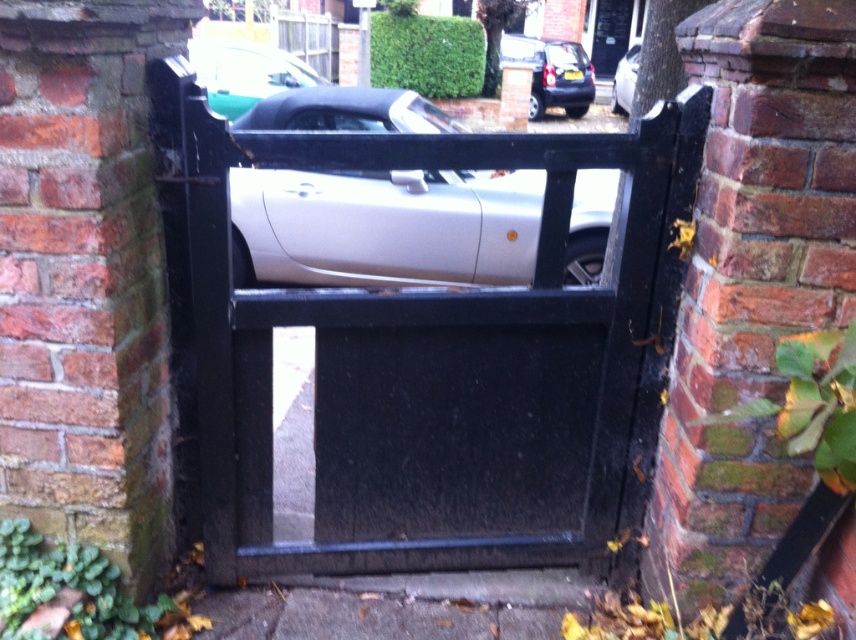
You are a delivery person trying to enter through the black wood gate at center. There is a satin silver car at center blocking the entrance. Can you pass through the gate without moving the car?

The black wood gate at center is bigger than the satin silver car at center, so there might be enough space around the car to pass through the gate without moving it. However, the exact path depends on the gate and car dimensions.

You are standing in front of the black wood gate at center and want to open it. The gate requires a clearance of 1.8 meters to fully open. Can the gate be opened without moving your position?

The black wood gate at center is 1.71 meters from viewer, which is less than the required 1.8 meters clearance. Therefore, the gate cannot be opened without moving your position to ensure sufficient space.

You are standing at the entrance of the residential area and want to enter through the gate. The entrance is at the bottom of the image. Which direction should you move relative to the point marked at coordinates point (x=437, y=365) to reach the gate?

The point marked at coordinates point (x=437, y=365) represents the black wood gate at center, so you should move towards that point to reach the gate.